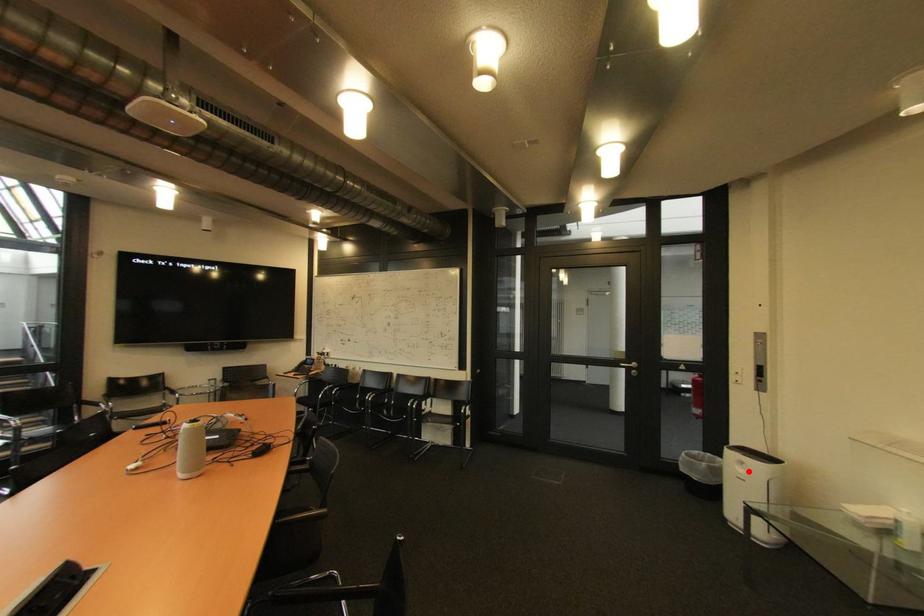
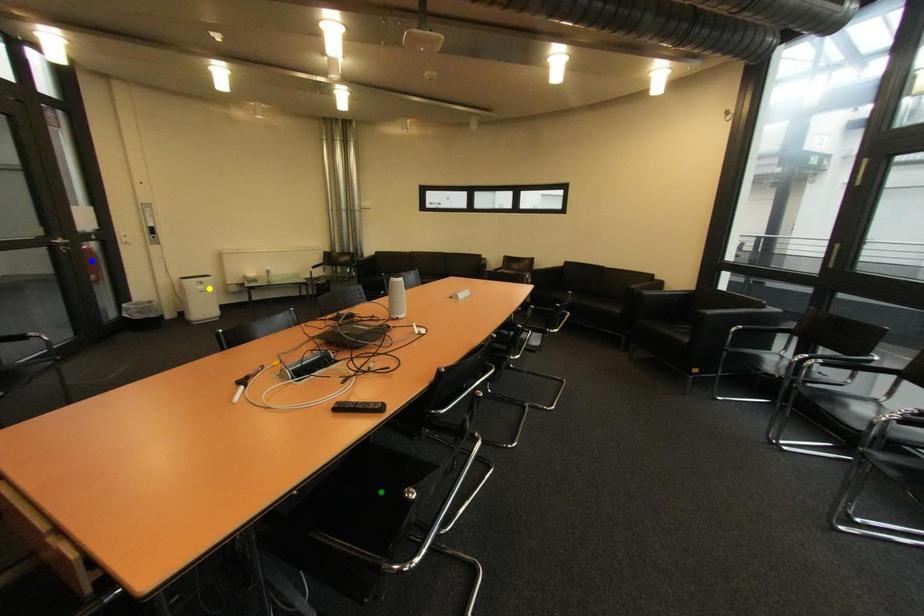
Question: I am providing you with two images of the same scene from different viewpoints. A red point is marked on the first image. You are given multiple points on the second image. Which mark in image 2 goes with the point in image 1?

Choices:
 (A) blue point
 (B) green point
 (C) yellow point

Answer: (C)